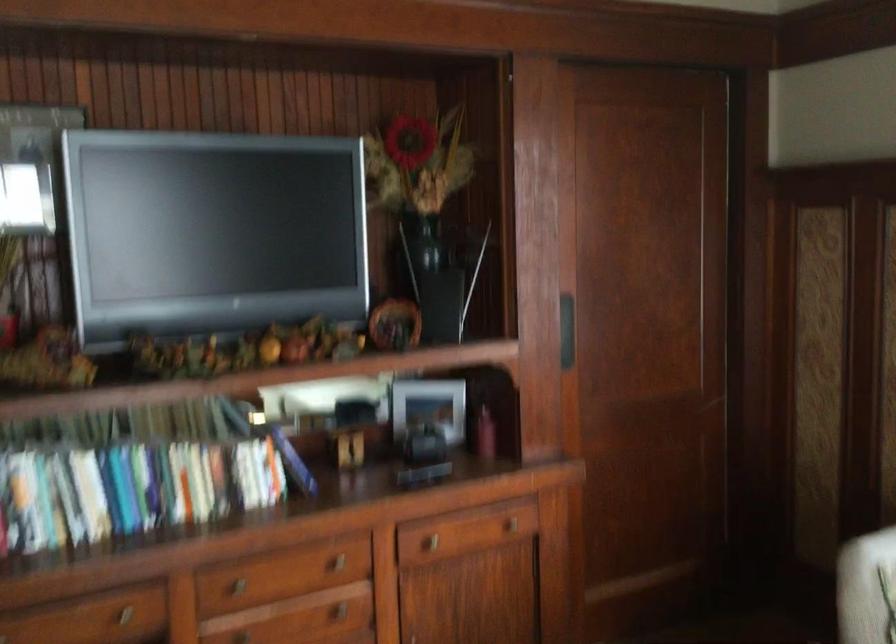
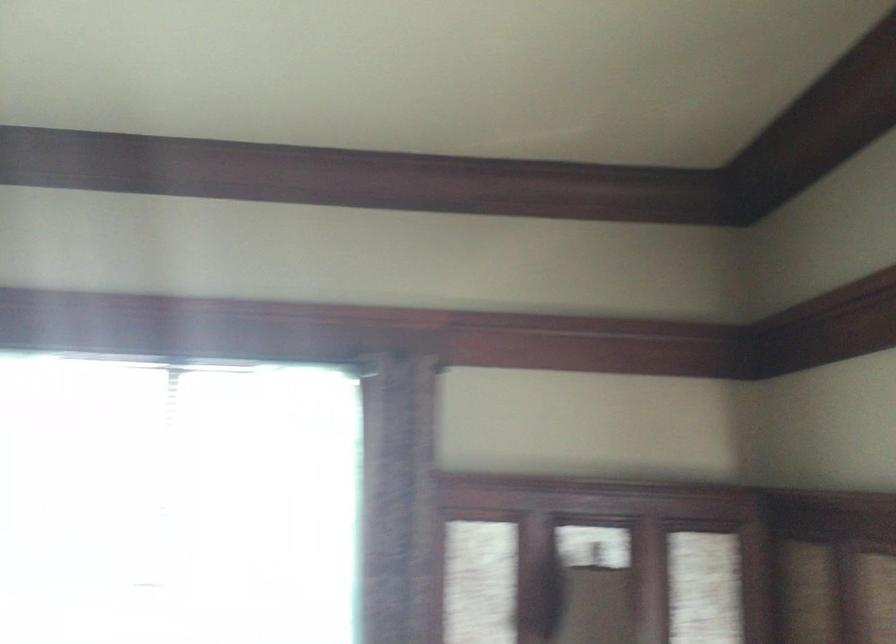
First-person continuous shooting, in which direction is the camera rotating?

The camera rotated toward right-up.